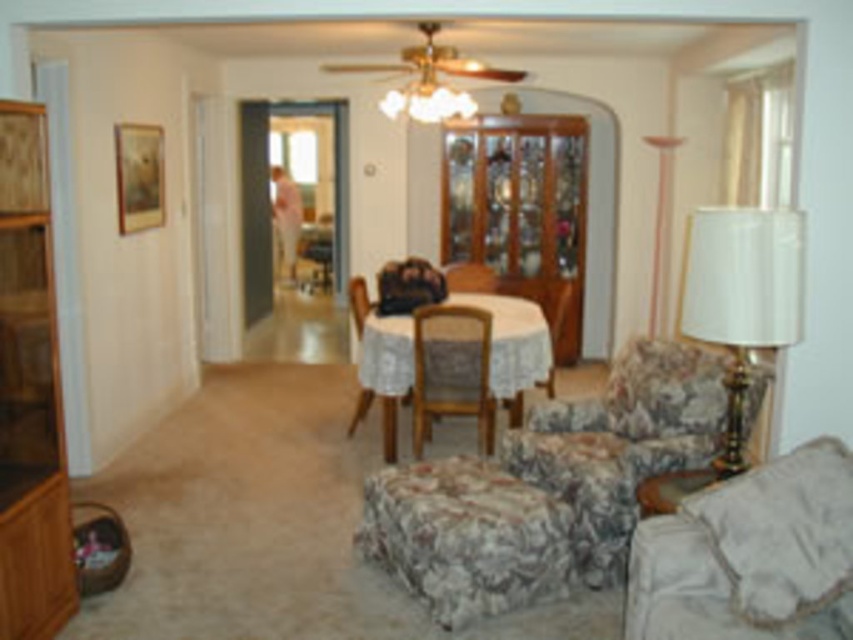
Question: Does light brown wood bookshelf at left have a larger size compared to white fabric lampshade at right?

Choices:
 (A) no
 (B) yes

Answer: (B)

Question: In this image, where is fluffy beige couch at lower right located relative to light brown wood bookshelf at left?

Choices:
 (A) right
 (B) left

Answer: (A)

Question: Which point is closer to the camera taking this photo?

Choices:
 (A) (375, 305)
 (B) (32, 120)
 (C) (480, 419)

Answer: (B)

Question: Which is farther from the light brown wood bookshelf at left?

Choices:
 (A) white lace tablecloth at center
 (B) wooden chair at center
 (C) floral fabric armchair at center
 (D) fluffy beige couch at lower right

Answer: (C)

Question: Is white fabric lampshade at right to the left of white lace tablecloth at center from the viewer's perspective?

Choices:
 (A) yes
 (B) no

Answer: (B)

Question: Which object appears farthest from the camera in this image?

Choices:
 (A) white fabric lampshade at right
 (B) fluffy beige couch at lower right
 (C) wooden chair at center

Answer: (C)